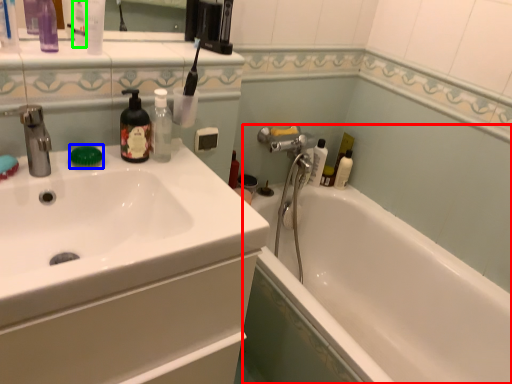
Question: Which is farther away from bathtub (highlighted by a red box)? soap (highlighted by a blue box) or mouthwash (highlighted by a green box)?

Choices:
 (A) soap
 (B) mouthwash

Answer: (B)